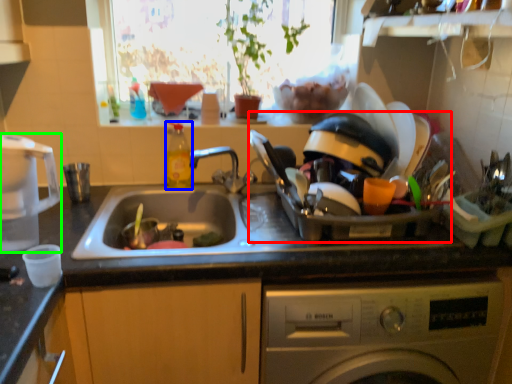
Question: Estimate the real-world distances between objects in this image. Which object is farther from appliance (highlighted by a red box), bottle (highlighted by a blue box) or appliance (highlighted by a green box)?

Choices:
 (A) bottle
 (B) appliance

Answer: (B)